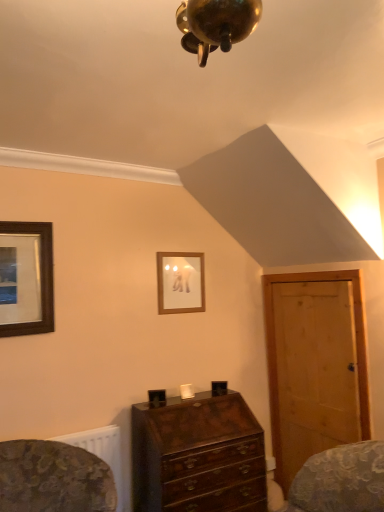
Question: Can you confirm if wooden framed picture at left, marked as the first picture frame in a left-to-right arrangement, is smaller than wooden picture frame at upper center, the 1th picture frame viewed from the right?

Choices:
 (A) no
 (B) yes

Answer: (A)

Question: Considering the relative sizes of wooden framed picture at left, which is the 2th picture frame from right to left, and wooden picture frame at upper center, the second picture frame in the front-to-back sequence, in the image provided, is wooden framed picture at left, which is the 2th picture frame from right to left, taller than wooden picture frame at upper center, the second picture frame in the front-to-back sequence,?

Choices:
 (A) yes
 (B) no

Answer: (A)

Question: Is wooden framed picture at left, the 1th picture frame from the front, positioned before wooden picture frame at upper center, the 1th picture frame viewed from the right?

Choices:
 (A) no
 (B) yes

Answer: (B)

Question: From a real-world perspective, is wooden framed picture at left, which appears as the 2th picture frame when viewed from the back, physically below wooden picture frame at upper center, the 1th picture frame viewed from the right?

Choices:
 (A) yes
 (B) no

Answer: (B)

Question: Is wooden framed picture at left, marked as the first picture frame in a left-to-right arrangement, bigger than wooden picture frame at upper center, the second picture frame viewed from the left?

Choices:
 (A) no
 (B) yes

Answer: (B)

Question: Relative to light brown wooden door at right, is mahogany wooden chest of drawers at center in front or behind?

Choices:
 (A) behind
 (B) front

Answer: (B)

Question: From a real-world perspective, is mahogany wooden chest of drawers at center physically located above or below light brown wooden door at right?

Choices:
 (A) above
 (B) below

Answer: (B)

Question: In terms of height, does mahogany wooden chest of drawers at center look taller or shorter compared to light brown wooden door at right?

Choices:
 (A) short
 (B) tall

Answer: (A)

Question: From the image's perspective, is mahogany wooden chest of drawers at center positioned above or below light brown wooden door at right?

Choices:
 (A) below
 (B) above

Answer: (A)

Question: Based on their positions, is light brown wooden door at right located to the left or right of wooden picture frame at upper center, the 1th picture frame viewed from the right?

Choices:
 (A) right
 (B) left

Answer: (A)

Question: From the image's perspective, relative to wooden picture frame at upper center, the second picture frame viewed from the left, is light brown wooden door at right above or below?

Choices:
 (A) above
 (B) below

Answer: (B)

Question: Choose the correct answer: Is light brown wooden door at right inside wooden picture frame at upper center, the 1th picture frame when ordered from back to front, or outside it?

Choices:
 (A) outside
 (B) inside

Answer: (A)

Question: Does point (319, 395) appear closer or farther from the camera than point (170, 273)?

Choices:
 (A) closer
 (B) farther

Answer: (A)

Question: Relative to wooden framed picture at left, the 1th picture frame from the front, is light brown wooden door at right in front or behind?

Choices:
 (A) behind
 (B) front

Answer: (A)

Question: From the image's perspective, is light brown wooden door at right positioned above or below wooden framed picture at left, the 1th picture frame from the front?

Choices:
 (A) above
 (B) below

Answer: (B)